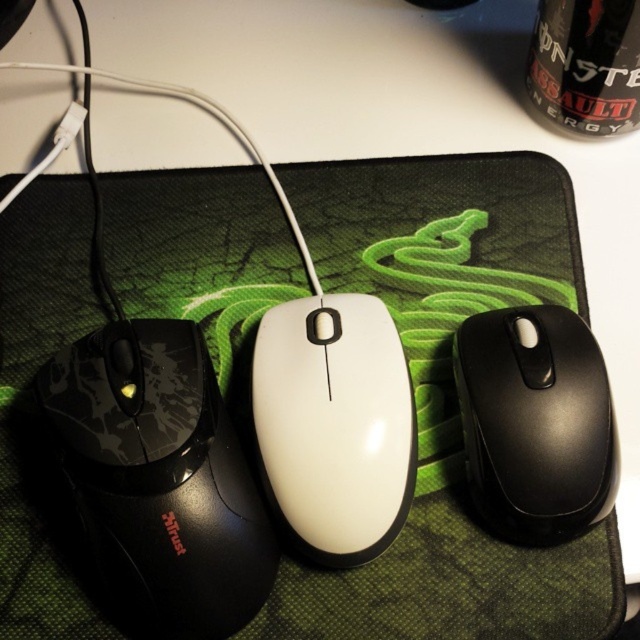
Question: Which object appears closest to the camera in this image?

Choices:
 (A) black matte mouse at lower right
 (B) white glossy mouse at center
 (C) green fabric mousepad at center
 (D) black matte mouse at left

Answer: (D)

Question: Considering the relative positions of green fabric mousepad at center and black matte mouse at lower right in the image provided, where is green fabric mousepad at center located with respect to black matte mouse at lower right?

Choices:
 (A) left
 (B) right

Answer: (A)

Question: Which object is positioned closest to the black matte mouse at lower right?

Choices:
 (A) green fabric mousepad at center
 (B) white glossy mouse at center
 (C) black matte mouse at left

Answer: (B)

Question: Is green fabric mousepad at center above white glossy mouse at center?

Choices:
 (A) yes
 (B) no

Answer: (A)

Question: Among these objects, which one is nearest to the camera?

Choices:
 (A) black matte mouse at lower right
 (B) white glossy mouse at center
 (C) black matte mouse at left

Answer: (C)

Question: Does black matte mouse at left appear on the left side of black matte mouse at lower right?

Choices:
 (A) no
 (B) yes

Answer: (B)